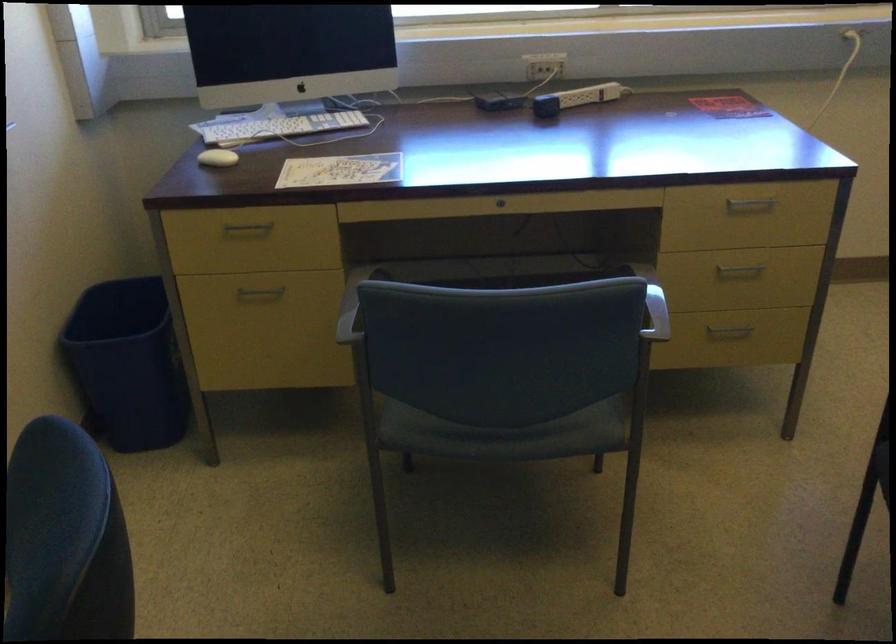
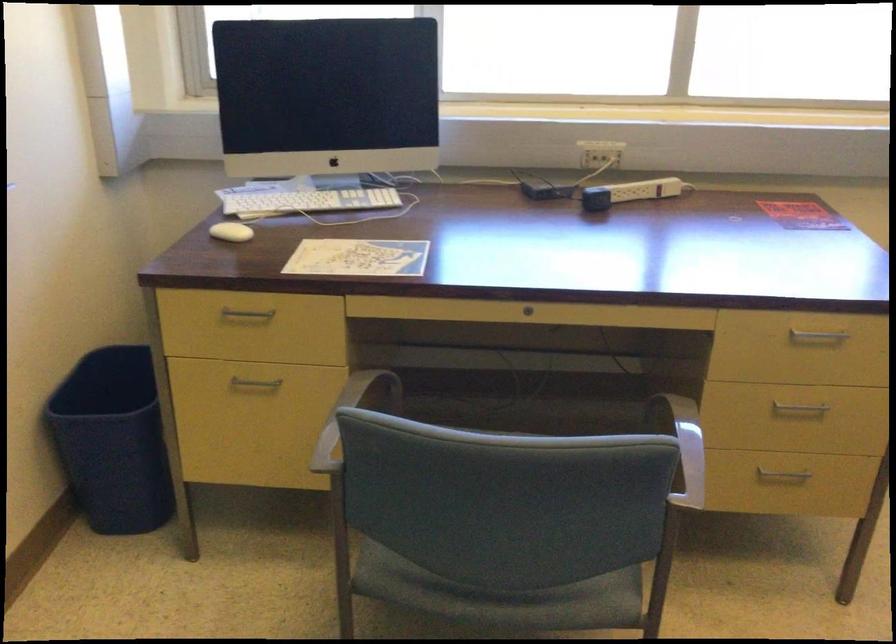
Where in the second image is the point corresponding to (506,437) from the first image?

(502, 597)